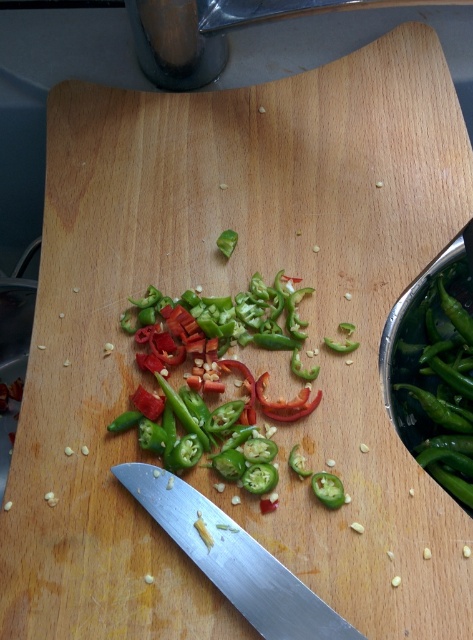
Is silver metallic knife at lower center further to camera compared to green glossy chili pepper at center?

No, silver metallic knife at lower center is in front of green glossy chili pepper at center.

Who is shorter, silver metallic knife at lower center or green glossy chili pepper at center?

silver metallic knife at lower center is shorter.

This screenshot has height=640, width=473. I want to click on silver metallic knife at lower center, so click(x=233, y=557).

What are the coordinates of `silver metallic knife at lower center` in the screenshot? It's located at (233, 557).